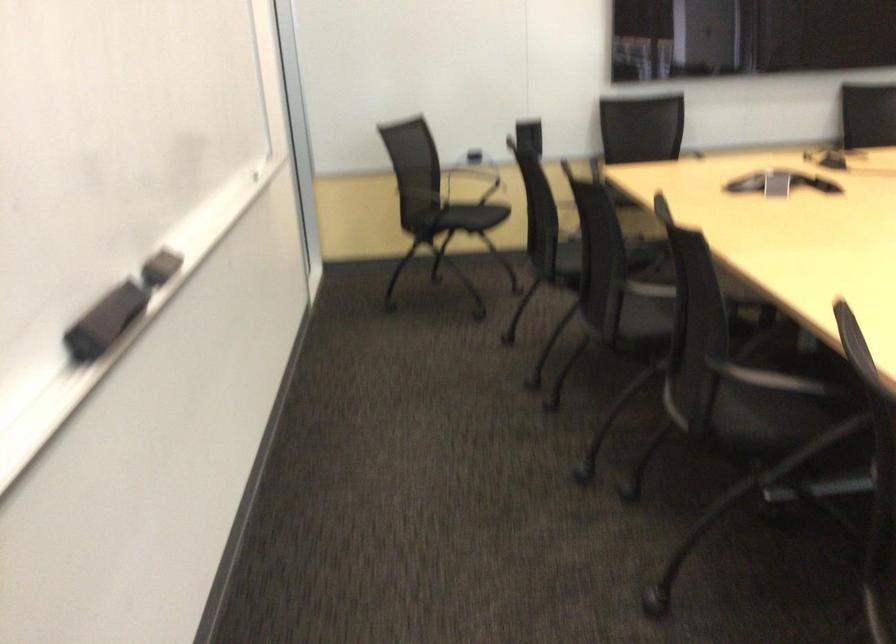
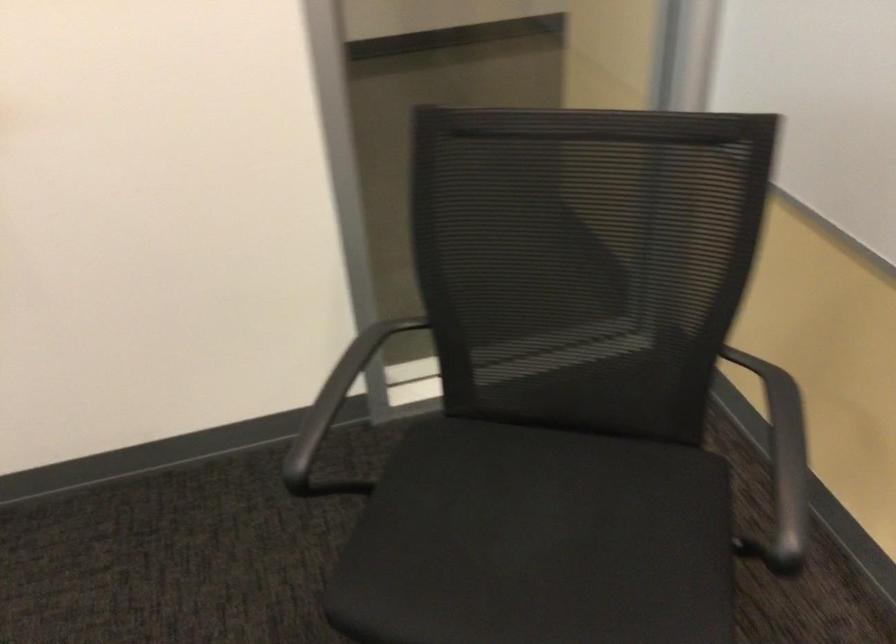
Find the pixel in the second image that matches point (478, 210) in the first image.

(538, 542)